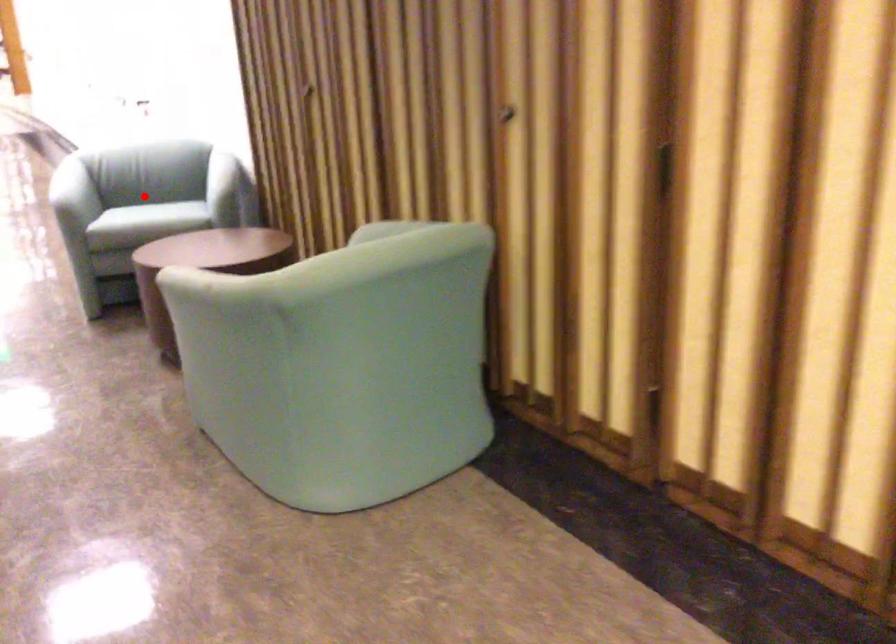
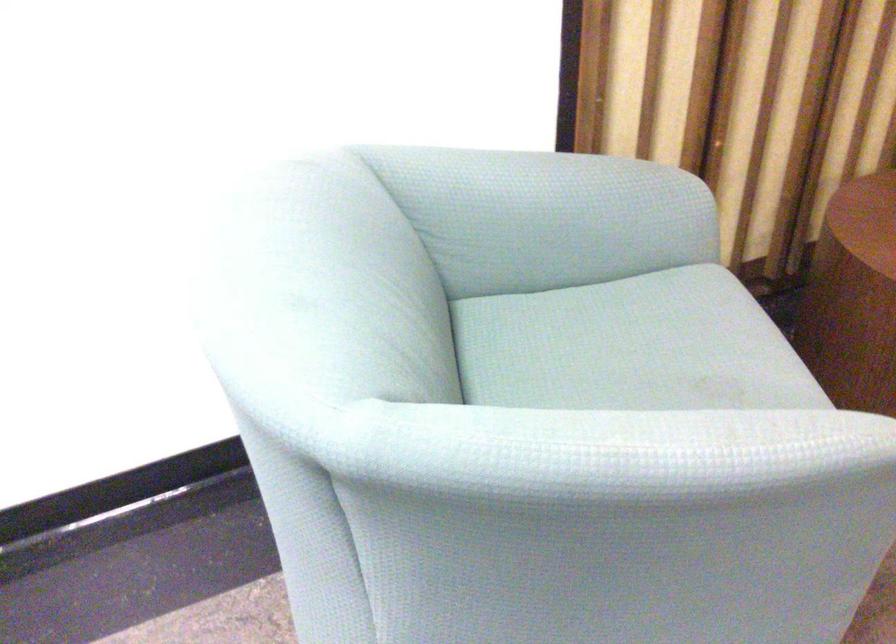
Find the pixel in the second image that matches the highlighted location in the first image.

(631, 346)